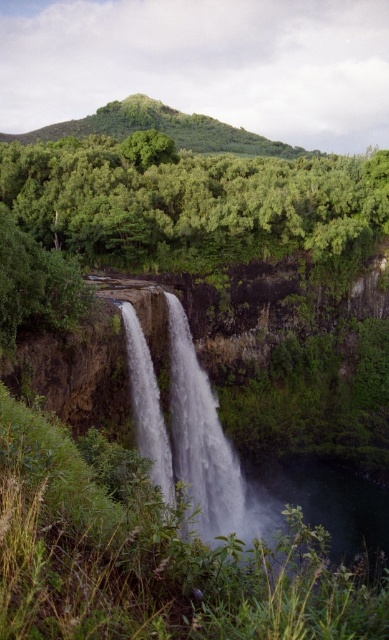
Who is shorter, green leafy trees at upper center or white frothy water at center?

Standing shorter between the two is white frothy water at center.

This screenshot has width=389, height=640. What do you see at coordinates (192, 200) in the screenshot? I see `green leafy trees at upper center` at bounding box center [192, 200].

Who is more forward, (85, 177) or (189, 492)?

Point (189, 492)

This screenshot has height=640, width=389. Identify the location of green leafy trees at upper center. (192, 200).

Which is behind, point (98, 253) or point (113, 128)?

Point (113, 128)

Does green leafy trees at upper center have a lesser height compared to green leafy hillside at upper center?

Correct, green leafy trees at upper center is not as tall as green leafy hillside at upper center.

The image size is (389, 640). I want to click on green leafy trees at upper center, so click(192, 200).

Can you confirm if white frothy water at center is bigger than green leafy hillside at upper center?

Incorrect, white frothy water at center is not larger than green leafy hillside at upper center.

From the picture: Who is positioned more to the right, white frothy water at center or green leafy hillside at upper center?

white frothy water at center is more to the right.

Does point (173, 336) come behind point (43, 140)?

That is False.

Identify the location of white frothy water at center. This screenshot has height=640, width=389. (185, 429).